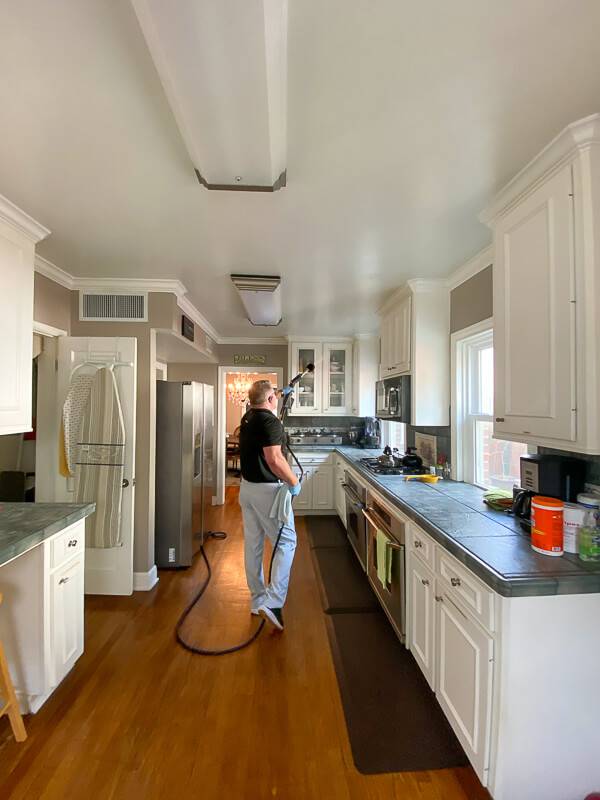
The image size is (600, 800). Find the location of `coffee maker on green countertop`. coffee maker on green countertop is located at coordinates (553, 480).